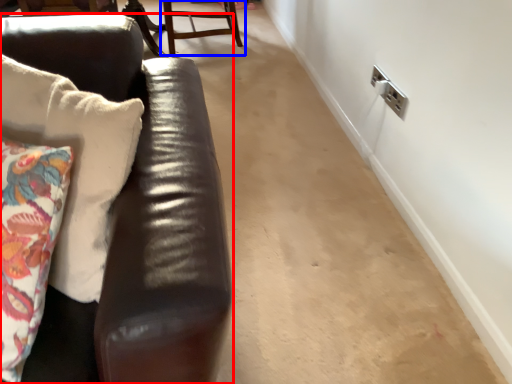
Question: Which of the following is the closest to the observer, studio couch (highlighted by a red box) or chair (highlighted by a blue box)?

Choices:
 (A) studio couch
 (B) chair

Answer: (A)